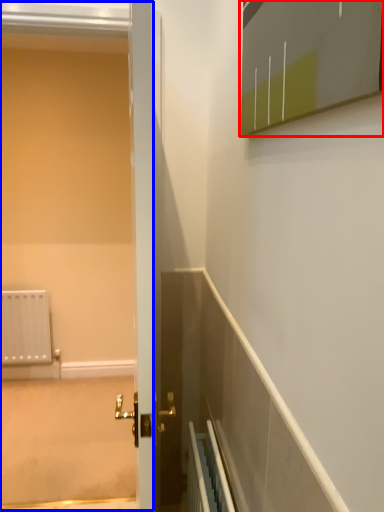
Question: Which of the following is the farthest to the observer, medicine cabinet (highlighted by a red box) or screen door (highlighted by a blue box)?

Choices:
 (A) medicine cabinet
 (B) screen door

Answer: (B)